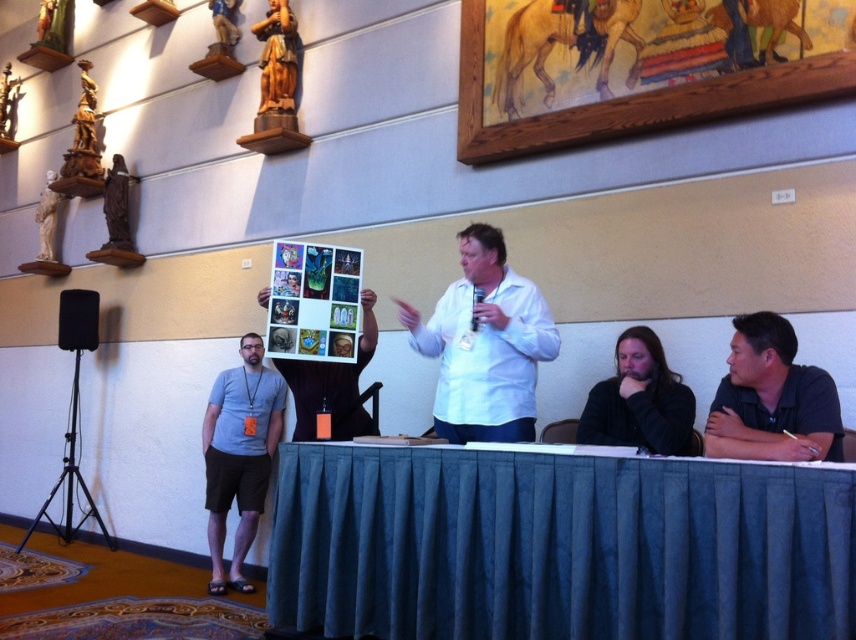
Question: Which point appears farthest from the camera in this image?

Choices:
 (A) [x=759, y=419]
 (B) [x=253, y=372]
 (C) [x=825, y=72]
 (D) [x=666, y=452]

Answer: (B)

Question: Is black matte shirt at lower right to the right of black matte speaker at left from the viewer's perspective?

Choices:
 (A) no
 (B) yes

Answer: (B)

Question: Which object is closer to the camera taking this photo?

Choices:
 (A) blue fabric table at lower center
 (B) gray fabric shorts at lower left
 (C) dark blue shirt at right

Answer: (A)

Question: Is blue fabric table at lower center to the right of dark blue shirt at right from the viewer's perspective?

Choices:
 (A) no
 (B) yes

Answer: (A)

Question: Which point is closer to the camera?

Choices:
 (A) (269, 589)
 (B) (569, 28)
 (C) (486, 412)
 (D) (80, 339)

Answer: (A)

Question: In this image, where is dark blue shirt at right located relative to black matte speaker at left?

Choices:
 (A) below
 (B) above

Answer: (A)